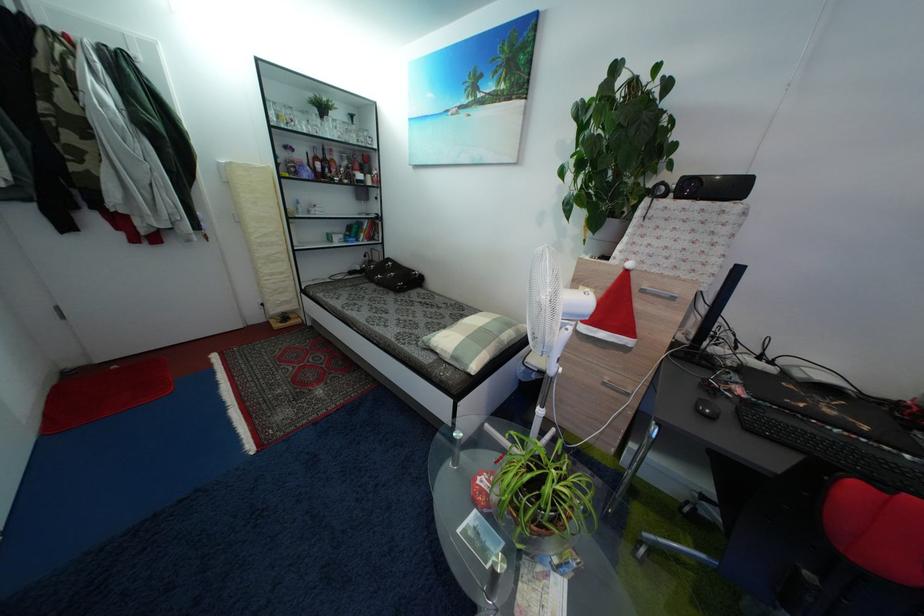
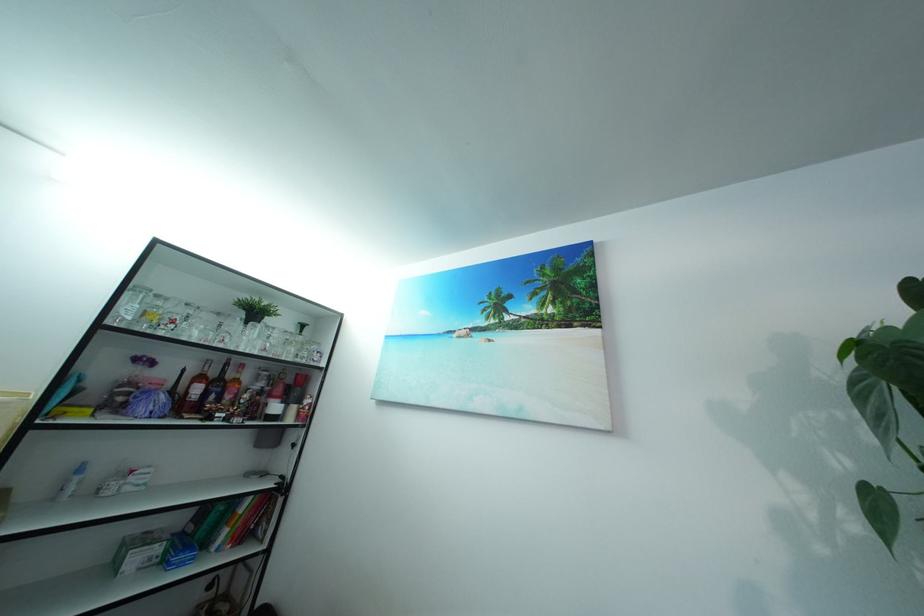
The point at (338, 138) is marked in the first image. Where is the corresponding point in the second image?

(257, 347)